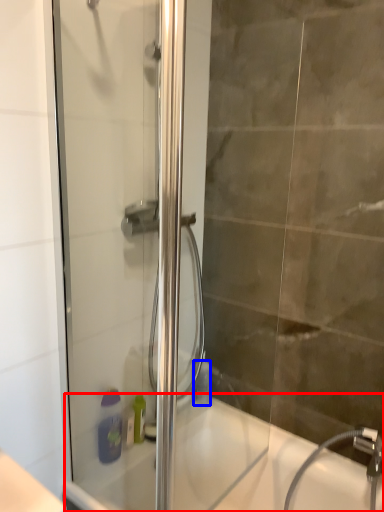
Question: Which object is further to the camera taking this photo, bath (highlighted by a red box) or toiletry (highlighted by a blue box)?

Choices:
 (A) bath
 (B) toiletry

Answer: (B)